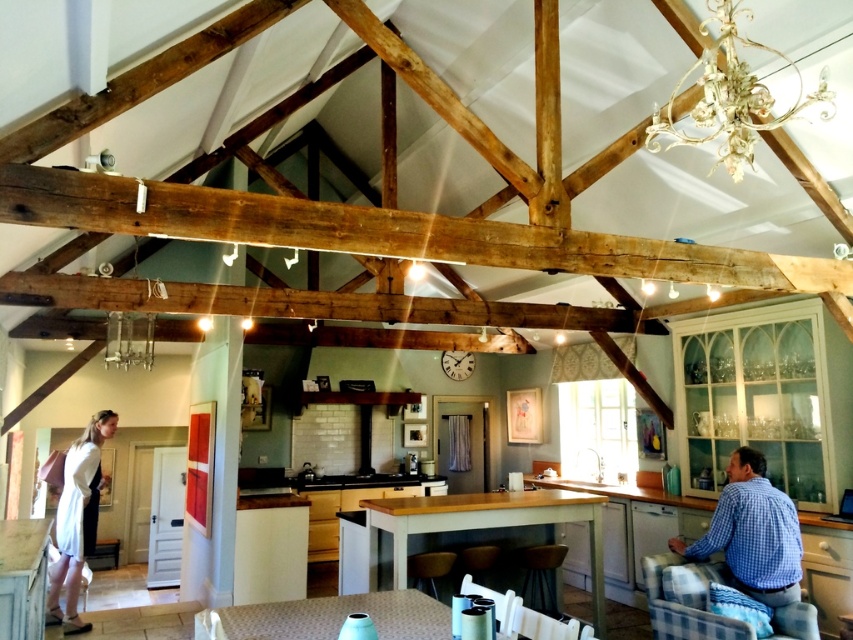
Which is behind, point (821, 83) or point (111, 333)?

The point (111, 333) is more distant.

The width and height of the screenshot is (853, 640). Find the location of `white ornate chandelier at upper right`. white ornate chandelier at upper right is located at coordinates (728, 92).

Locate an element on the screen. white ornate chandelier at upper right is located at coordinates (728, 92).

What do you see at coordinates (728, 92) in the screenshot? I see `white ornate chandelier at upper right` at bounding box center [728, 92].

Image resolution: width=853 pixels, height=640 pixels. Identify the location of white ornate chandelier at upper right. pos(728,92).

Is point (73, 472) farther from viewer compared to point (149, 337)?

That is False.

Does white cotton dress at lower left have a lesser width compared to metallic glass chandelier at upper center?

Yes, white cotton dress at lower left is thinner than metallic glass chandelier at upper center.

The image size is (853, 640). Find the location of `white cotton dress at lower left`. white cotton dress at lower left is located at coordinates (77, 518).